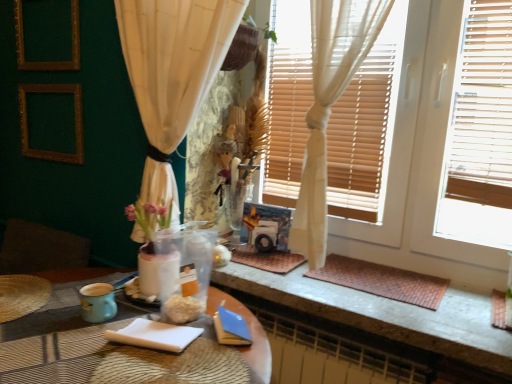
Identify the location of free space on the front side of white paper notepad at lower center. Image resolution: width=512 pixels, height=384 pixels. (131, 366).